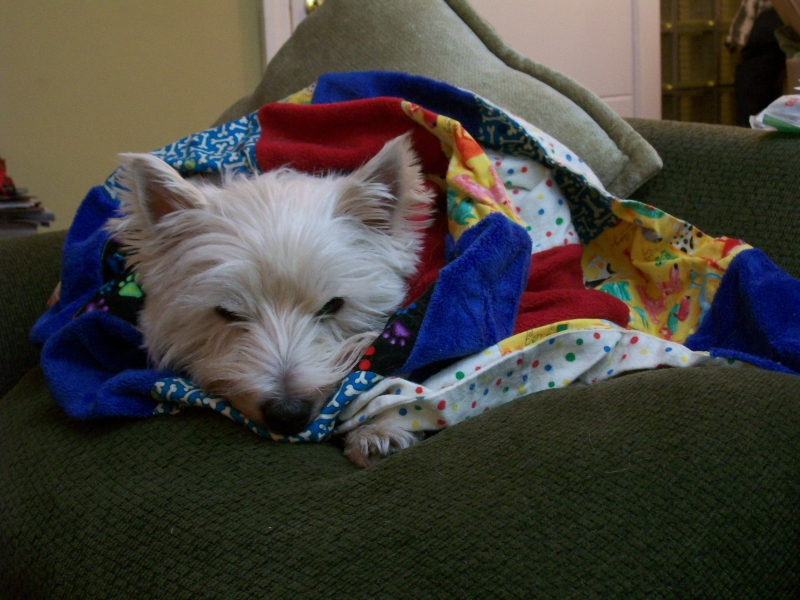
This screenshot has height=600, width=800. What are the coordinates of `cushion` in the screenshot? It's located at (442, 46).